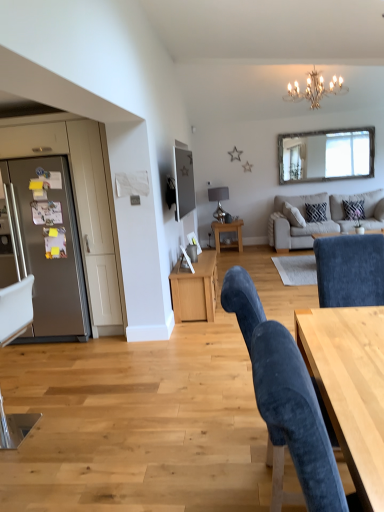
Locate an element on the screen. The image size is (384, 512). unoccupied space behind velvet blue chair at lower right, which is the 1th chair in front-to-back order is located at coordinates (235, 426).